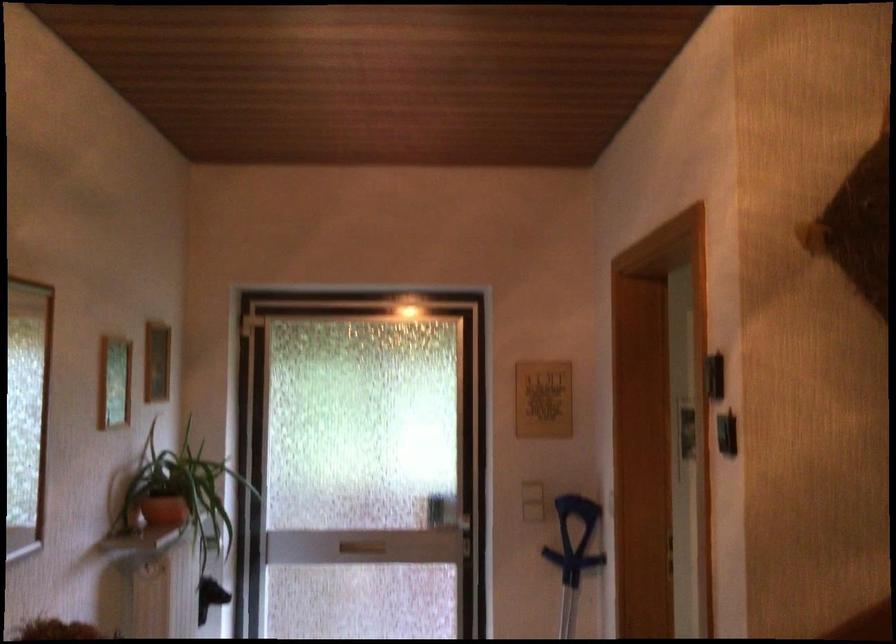
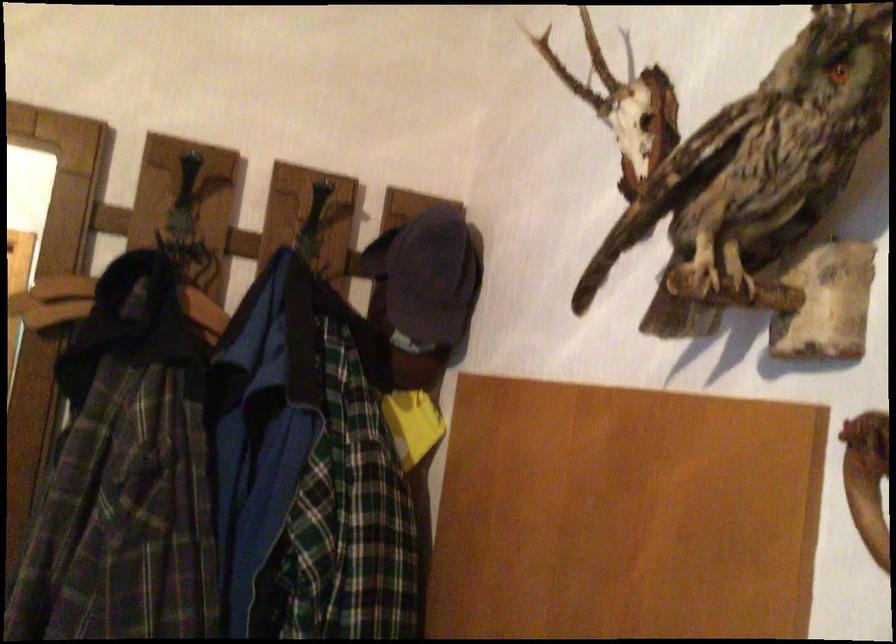
Question: The camera is either moving clockwise (left) or counter-clockwise (right) around the object. The first image is from the beginning of the video and the second image is from the end. Is the camera moving left or right when shooting the video?

Choices:
 (A) Left
 (B) Right

Answer: (A)